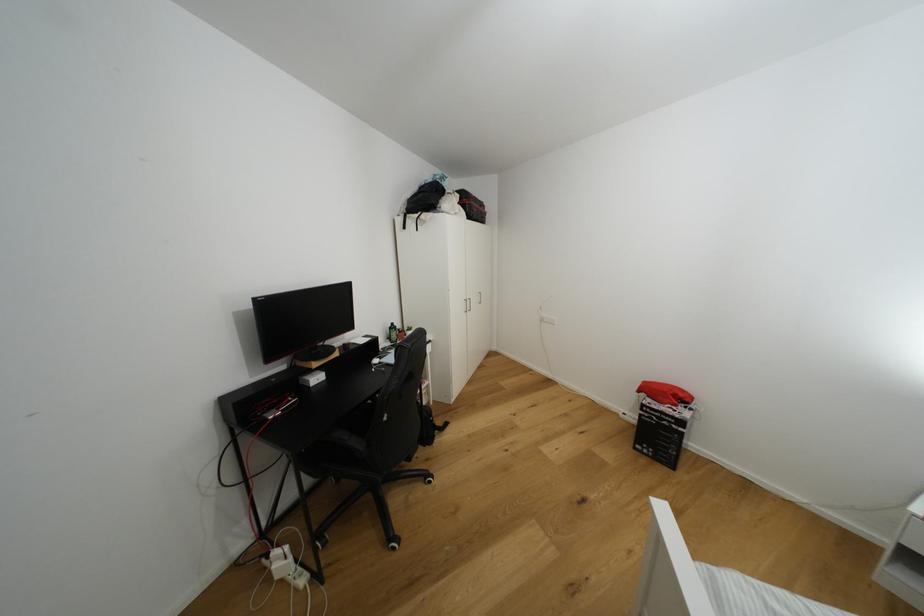
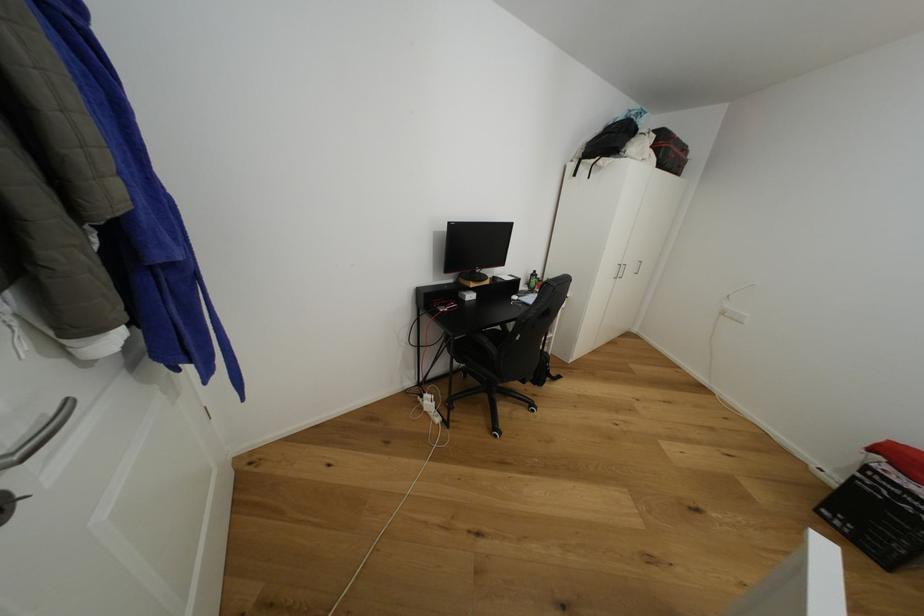
Find the pixel in the second image that matches the point at 311,379 in the first image.

(469, 294)